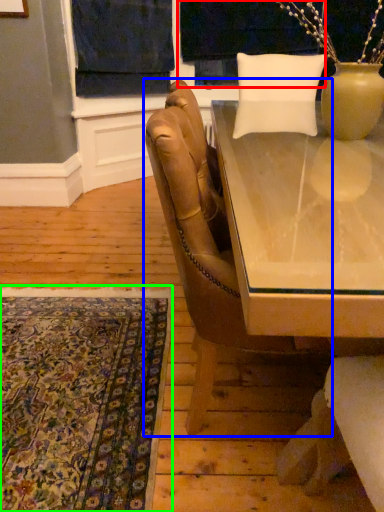
Question: Considering the real-world distances, which object is farthest from window screen (highlighted by a red box)? chair (highlighted by a blue box) or mat (highlighted by a green box)?

Choices:
 (A) chair
 (B) mat

Answer: (B)